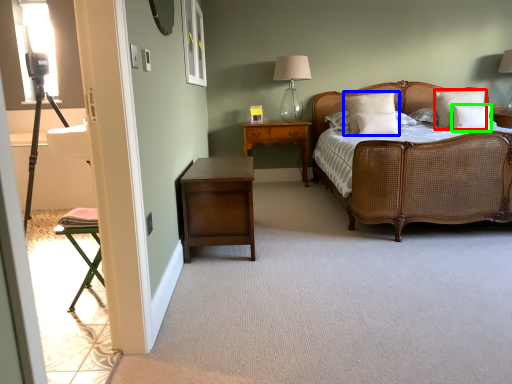
Question: Considering the real-world distances, which object is closest to pillow (highlighted by a red box)? pillow (highlighted by a blue box) or pillow (highlighted by a green box).

Choices:
 (A) pillow
 (B) pillow

Answer: (B)